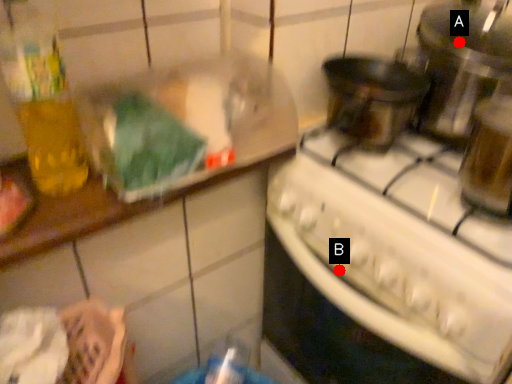
Question: Two points are circled on the image, labeled by A and B beside each circle. Which point is farther from the camera taking this photo?

Choices:
 (A) A is further
 (B) B is further

Answer: (A)